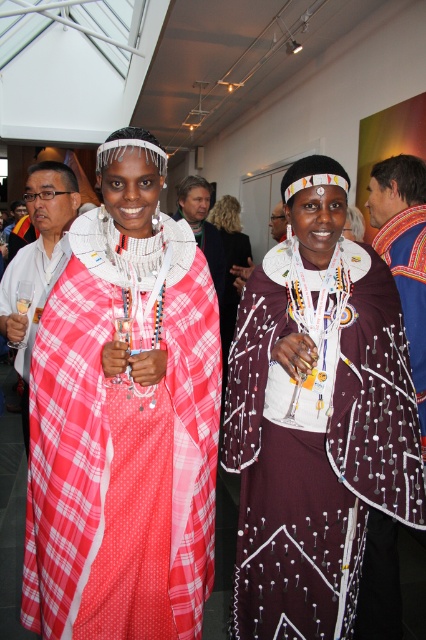
Question: Which point appears closest to the camera in this image?

Choices:
 (A) (161, 586)
 (B) (345, 284)
 (C) (270, 227)

Answer: (B)

Question: Which point is closer to the camera taking this photo?

Choices:
 (A) (291, 541)
 (B) (394, 193)

Answer: (A)

Question: Which point appears closest to the camera in this image?

Choices:
 (A) [x=213, y=248]
 (B) [x=393, y=186]

Answer: (B)

Question: Does maroon fabric dress at center come in front of maroon woven fabric at center?

Choices:
 (A) yes
 (B) no

Answer: (A)

Question: Is maroon woven fabric at center closer to the viewer compared to plaid fabric dress at center?

Choices:
 (A) yes
 (B) no

Answer: (A)

Question: Considering the relative positions of maroon woven fabric at center and plaid fabric dress at center in the image provided, where is maroon woven fabric at center located with respect to plaid fabric dress at center?

Choices:
 (A) left
 (B) right

Answer: (B)